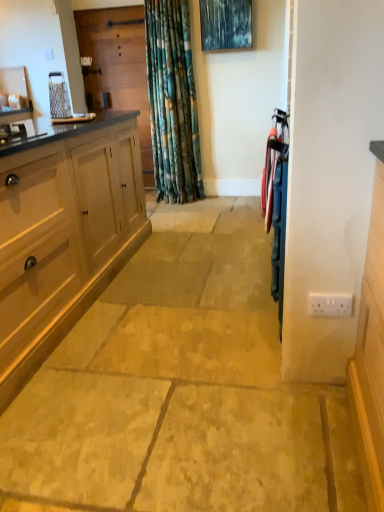
You are a GUI agent. You are given a task and a screenshot of the screen. Output one action in this format:
    pyautogui.click(x=<x>, y=<y>)
    Task: Click on the free spot in front of metallic blue screen door at right, marked as the second screen door in a back-to-front arrangement
    This screenshot has height=512, width=384.
    Given the screenshot: What is the action you would take?
    pyautogui.click(x=319, y=411)